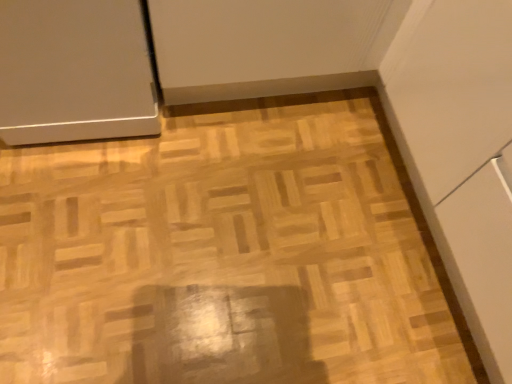
What are the coordinates of `blank space above natural wood parquet floor at center (from a real-world perspective)` in the screenshot? It's located at (232, 220).